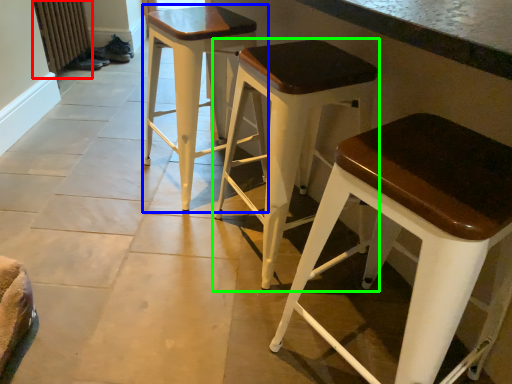
Question: Considering the real-world distances, which object is farthest from radiator (highlighted by a red box)? stool (highlighted by a blue box) or stool (highlighted by a green box)?

Choices:
 (A) stool
 (B) stool

Answer: (B)